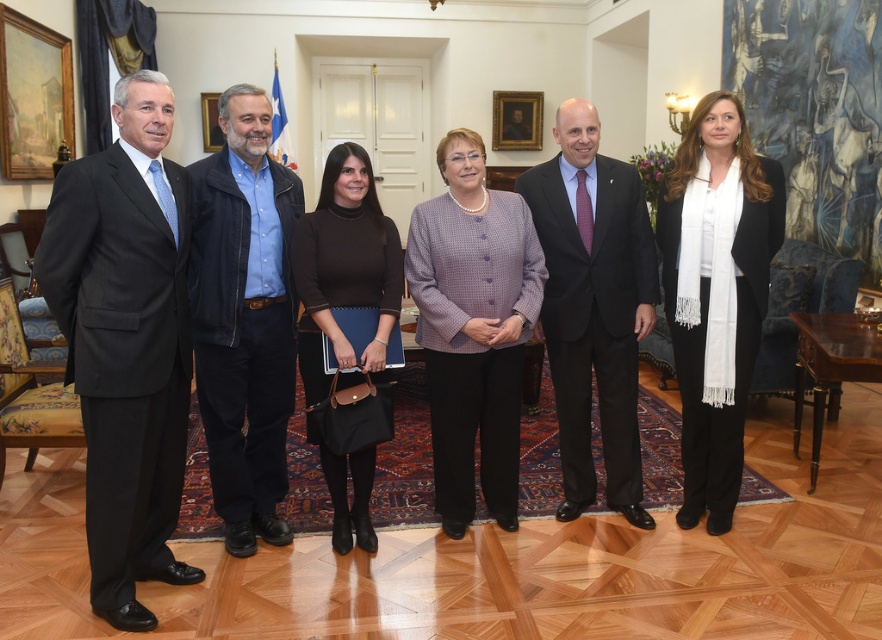
From the picture: You are standing at the center of the room and want to move towards the point marked at coordinates (x=593, y=305). Which direction should you move to reach the matte black suit at center?

The point at coordinates (x=593, y=305) corresponds to the matte black suit at center, so you should move towards that direction to reach it.

You are standing at the point labeled as point (93, 506). You want to walk to the nearest wall. Which direction should you walk?

Since you are at point (93, 506), you should walk towards the nearest wall. The walls are located at the edges of the room. The point (93, 506) is closer to the bottom edge of the room, so you should walk downward to reach the nearest wall.